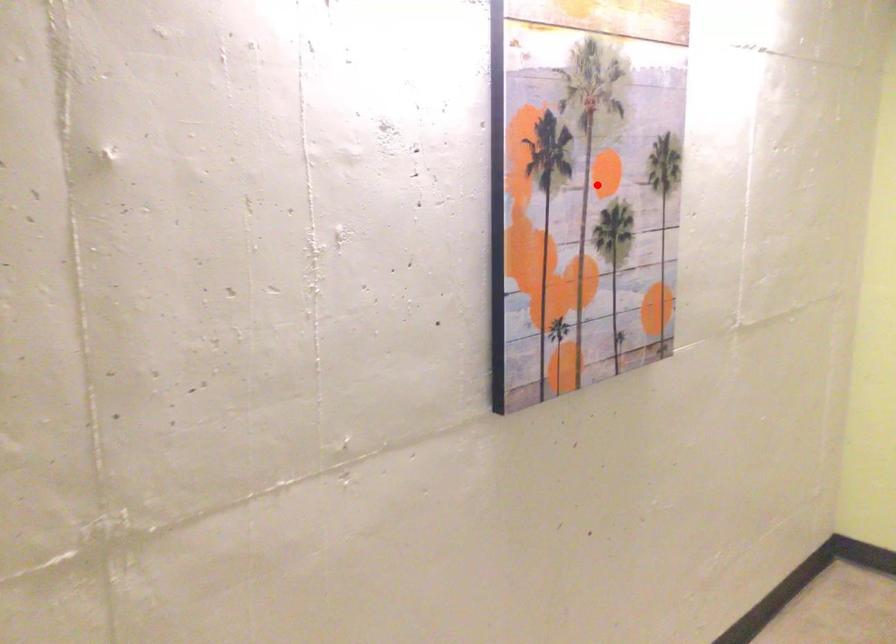
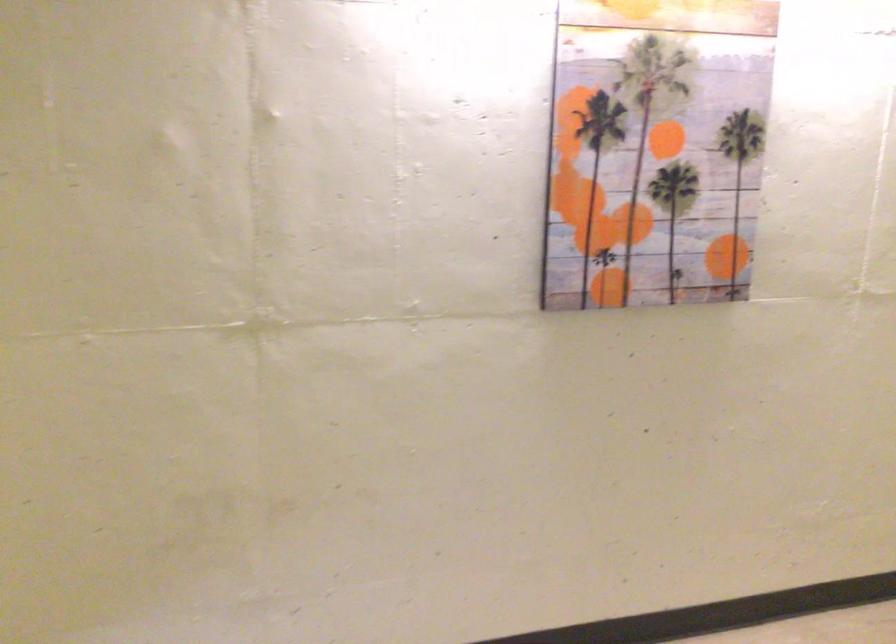
In the second image, find the point that corresponds to the highlighted location in the first image.

(655, 149)